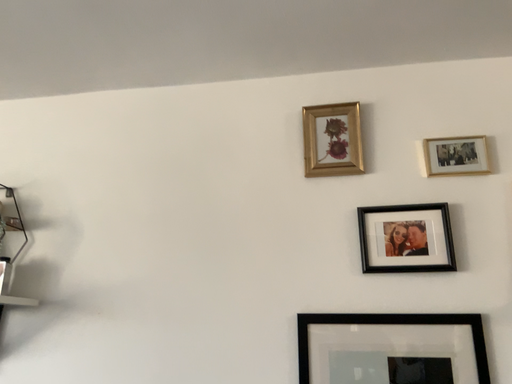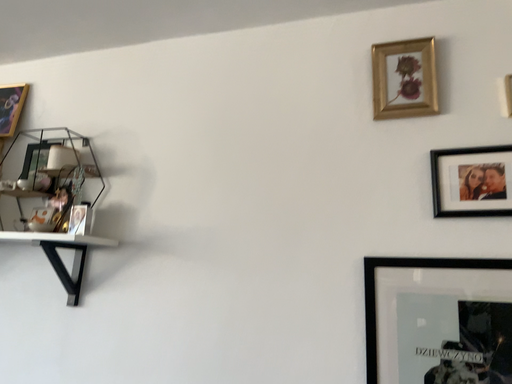
Question: Which way did the camera rotate in the video?

Choices:
 (A) rotated right
 (B) rotated left

Answer: (B)